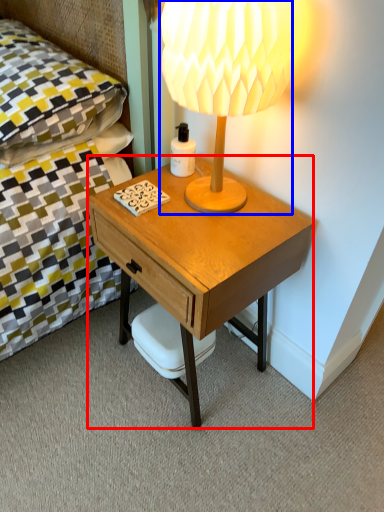
Question: Which point is closer to the camera, desk (highlighted by a red box) or lamp (highlighted by a blue box)?

Choices:
 (A) desk
 (B) lamp

Answer: (B)